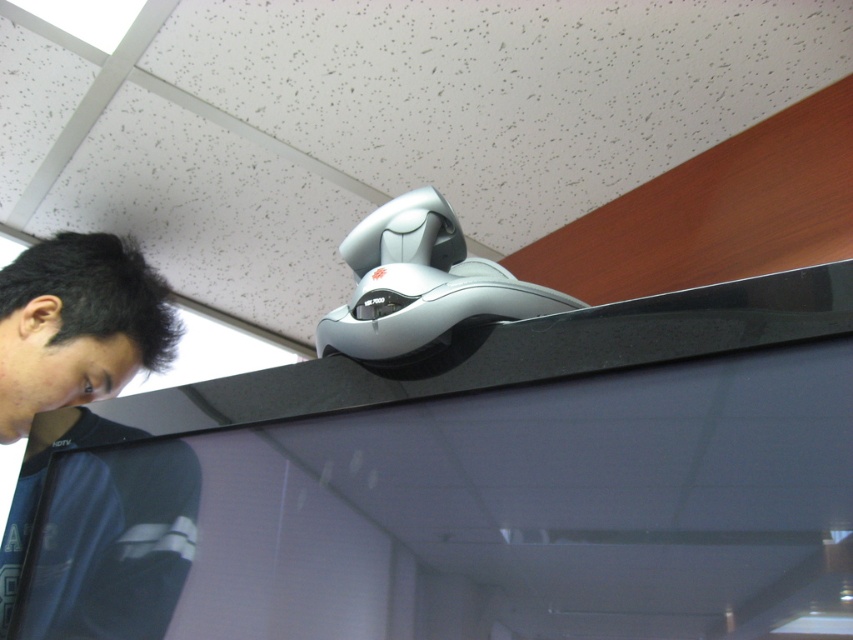
Who is shorter, black fabric at lower left or black matte hair at upper left?

black matte hair at upper left is shorter.

Is black fabric at lower left closer to the viewer compared to black matte hair at upper left?

Yes, it is in front of black matte hair at upper left.

Is point (45, 342) positioned in front of point (26, 264)?

Yes, it is in front of point (26, 264).

Locate an element on the screen. The height and width of the screenshot is (640, 853). black fabric at lower left is located at coordinates (70, 358).

Can you confirm if glossy plastic monitor at upper center is taller than black matte hair at upper left?

Yes.

Is glossy plastic monitor at upper center in front of black matte hair at upper left?

Yes, glossy plastic monitor at upper center is closer to the viewer.

At what (x,y) coordinates should I click in order to perform the action: click on glossy plastic monitor at upper center. Please return your answer as a coordinate pair (x, y). The width and height of the screenshot is (853, 640). Looking at the image, I should click on (476, 484).

Does glossy plastic monitor at upper center appear under black fabric at lower left?

Correct, glossy plastic monitor at upper center is located below black fabric at lower left.

Which is more to the left, glossy plastic monitor at upper center or black fabric at lower left?

black fabric at lower left is more to the left.

The image size is (853, 640). What are the coordinates of `glossy plastic monitor at upper center` in the screenshot? It's located at (476, 484).